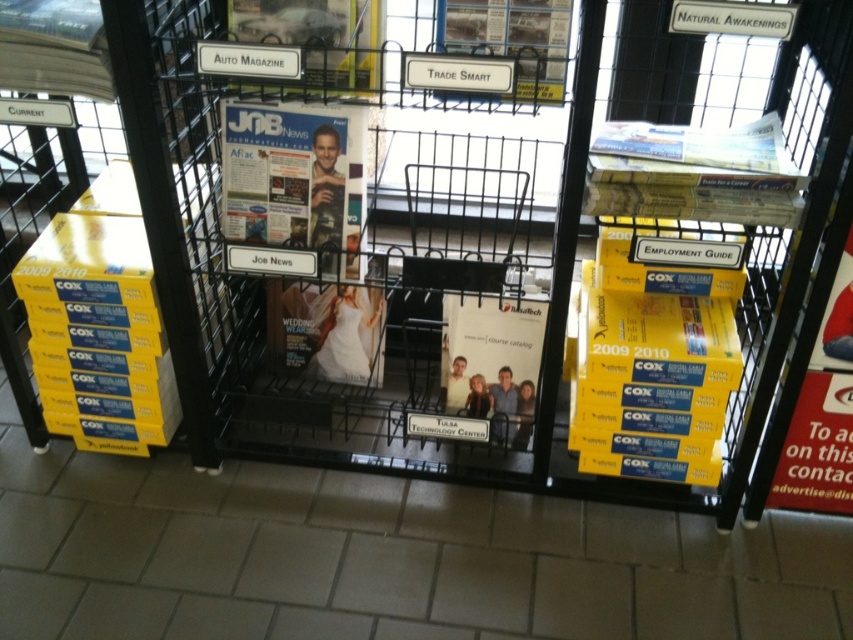
You are organizing a promotional event and need to place a 12cm wide promotional material between the matte paper magazine at center and the white paper at center. Can you fit it there?

The matte paper magazine at center is wider than the white paper at center. The combined width of both items would need to be measured to determine if there is enough space for the 12cm promotional material. However, since the magazine is wider, it might leave sufficient space when placed next to the narrower white paper.

You are a customer looking for the magazine and the white paper in the store. According to the image, which one is positioned more to the right between the matte paper magazine at center and the white paper at center?

The white paper at center is positioned more to the right than the matte paper magazine at center.